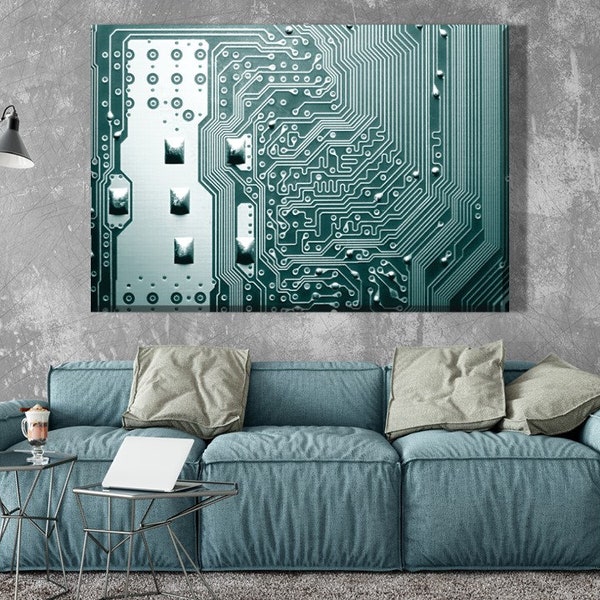
I want to click on light fixture, so click(11, 142).